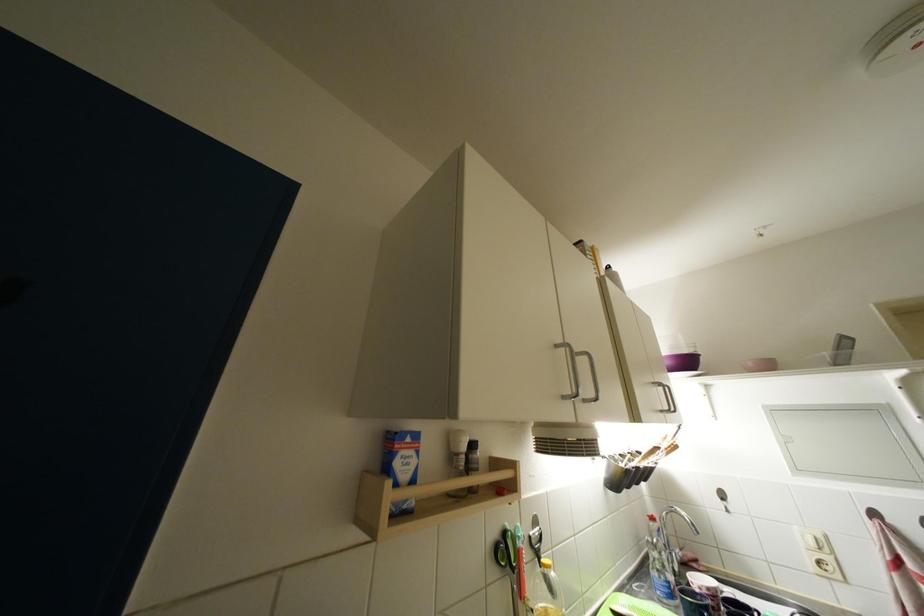
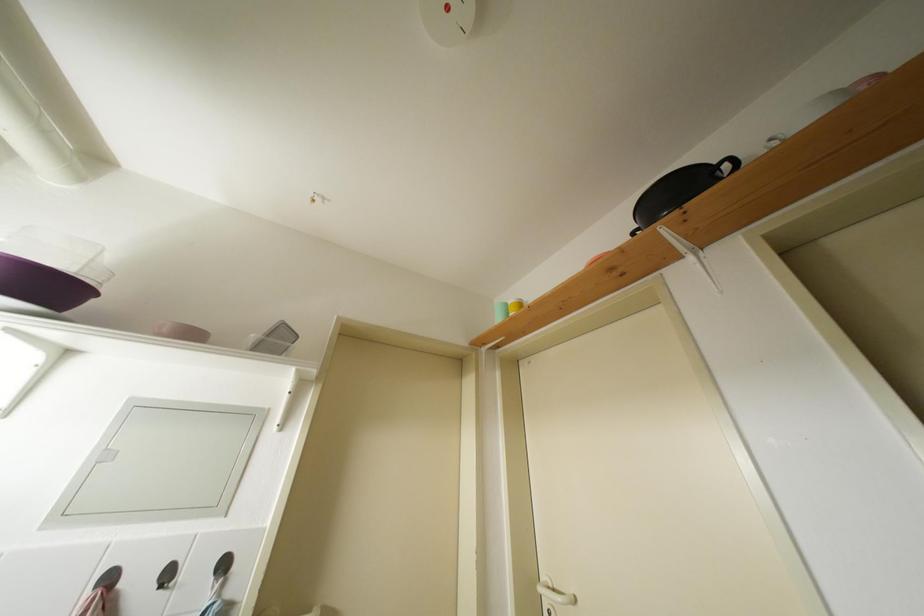
The first image is from the beginning of the video and the second image is from the end. How did the camera likely rotate when shooting the video?

The camera rotated toward right-up.